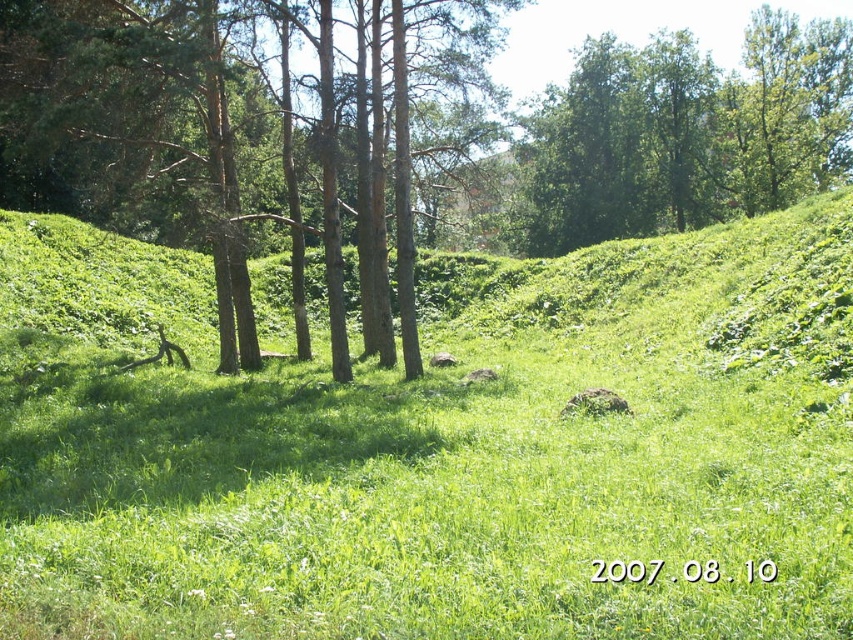
Is point (85, 141) positioned after point (775, 116)?

No.

Where is `green bark tree at center`? The height and width of the screenshot is (640, 853). green bark tree at center is located at coordinates 161,125.

Where is `green grassy at center`? green grassy at center is located at coordinates (428, 449).

Based on the photo, measure the distance between point (355, 524) and camera.

6.46 meters

Where is `green grassy at center`? Image resolution: width=853 pixels, height=640 pixels. green grassy at center is located at coordinates pyautogui.click(x=428, y=449).

Does point (541, 396) lie behind point (662, 134)?

No, (541, 396) is closer to viewer.

Is green grassy at center smaller than green leafy tree at upper center?

Indeed, green grassy at center has a smaller size compared to green leafy tree at upper center.

Is point (833, 237) closer to viewer compared to point (656, 156)?

Yes, point (833, 237) is closer to viewer.

Locate an element on the screen. green grassy at center is located at coordinates (428, 449).